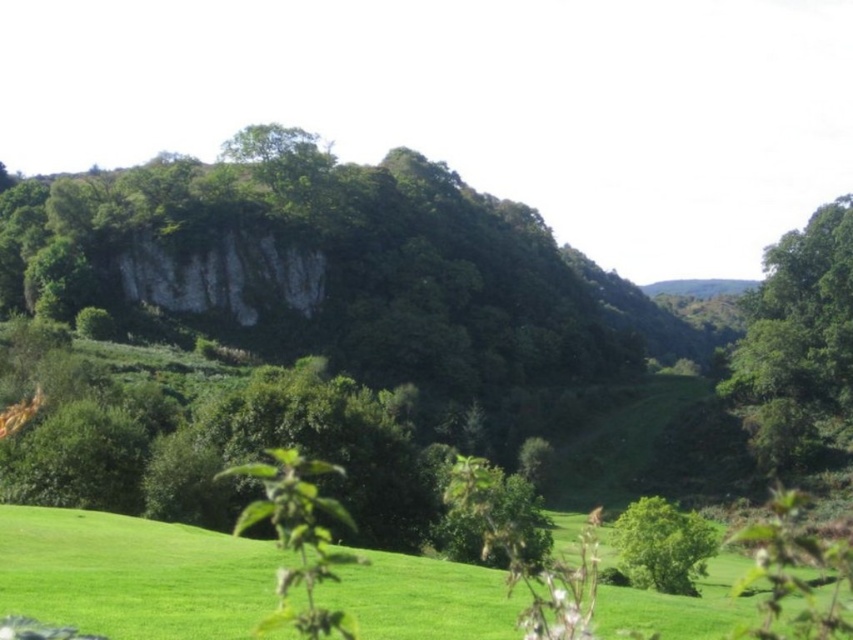
Can you confirm if green grassy field at lower center is taller than green leafy tree at center?

Yes.

Based on the photo, which is above, green grassy field at lower center or green leafy tree at center?

green grassy field at lower center is higher up.

I want to click on green grassy field at lower center, so click(132, 573).

Does green grassy field at lower center have a larger size compared to green leafy tree at upper right?

Incorrect, green grassy field at lower center is not larger than green leafy tree at upper right.

Which is above, green grassy field at lower center or green leafy tree at upper right?

Positioned higher is green leafy tree at upper right.

Which is in front, point (24, 515) or point (764, 460)?

Point (24, 515)

Locate an element on the screen. The image size is (853, 640). green grassy field at lower center is located at coordinates (132, 573).

Which is behind, point (790, 323) or point (635, 528)?

The point (790, 323) is behind.

What do you see at coordinates (798, 342) in the screenshot? I see `green leafy tree at upper right` at bounding box center [798, 342].

Is point (848, 198) behind point (663, 509)?

Yes, point (848, 198) is farther from viewer.

This screenshot has width=853, height=640. Identify the location of green leafy tree at upper right. (798, 342).